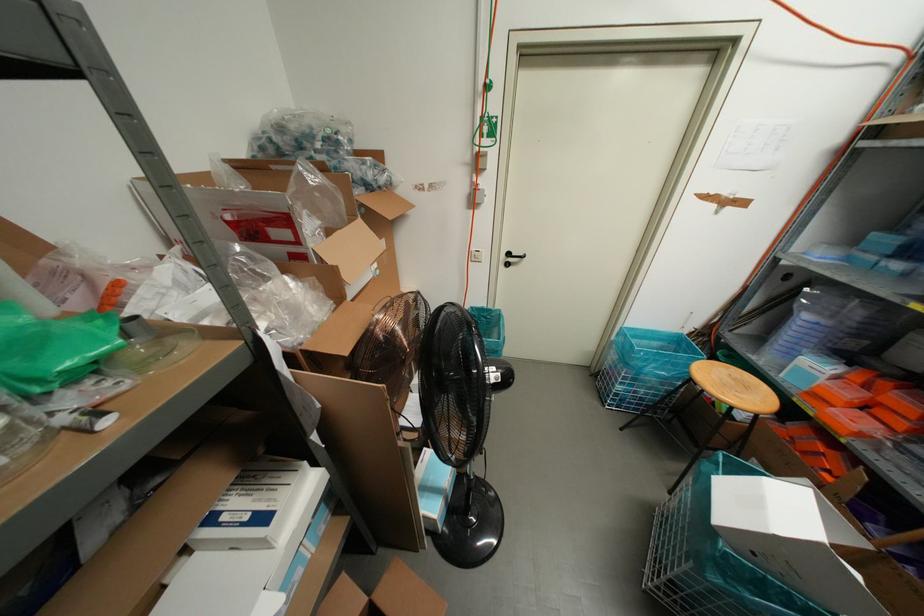
At what (x,y) coordinates should I click in order to perform the action: click on orange plastic box. Please return your answer as a coordinate pair (x, y). The height and width of the screenshot is (616, 924). Looking at the image, I should click on (842, 392).